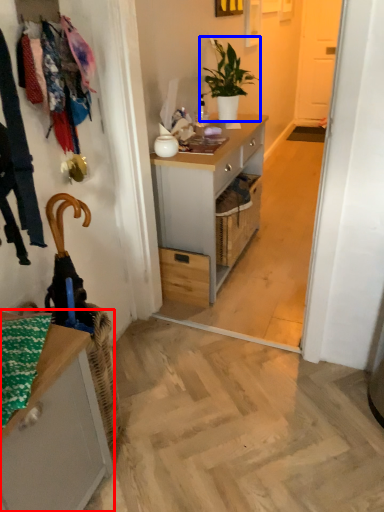
Question: Among these objects, which one is farthest to the camera, cabinetry (highlighted by a red box) or houseplant (highlighted by a blue box)?

Choices:
 (A) cabinetry
 (B) houseplant

Answer: (B)